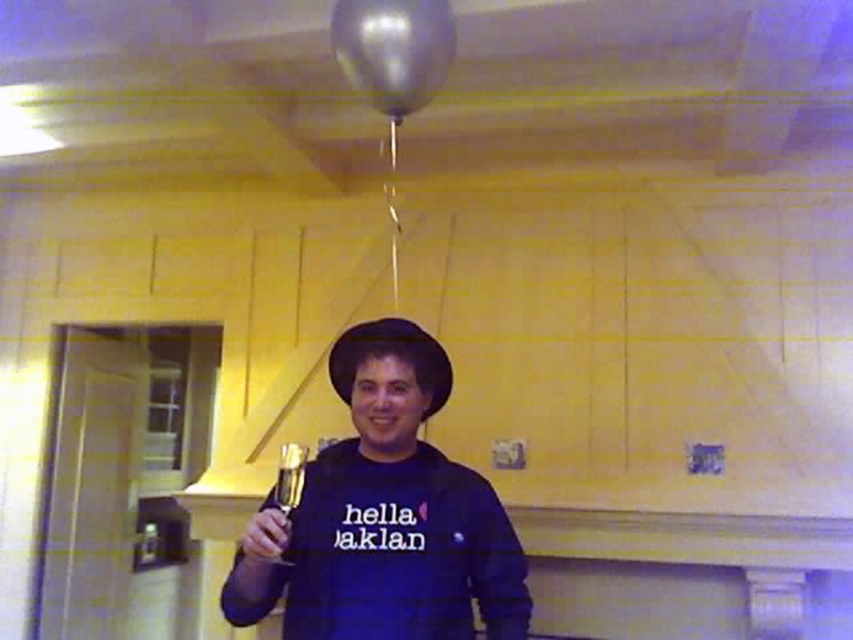
Question: Can you confirm if matte black hat at center is bigger than transparent metallic balloon at upper center?

Choices:
 (A) yes
 (B) no

Answer: (A)

Question: Does matte black hat at center appear under transparent metallic balloon at upper center?

Choices:
 (A) yes
 (B) no

Answer: (A)

Question: Which of the following is the closest to the observer?

Choices:
 (A) (345, 74)
 (B) (462, 504)

Answer: (B)

Question: Which of the following is the farthest from the observer?

Choices:
 (A) transparent metallic balloon at upper center
 (B) matte black hat at center

Answer: (A)

Question: Is matte black hat at center wider than transparent metallic balloon at upper center?

Choices:
 (A) yes
 (B) no

Answer: (A)